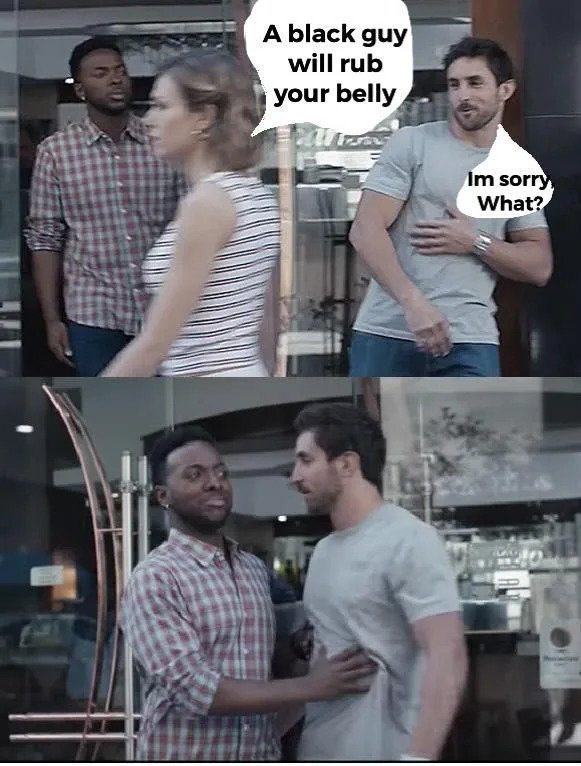
The image size is (581, 766). I want to click on register, so click(40, 629), click(44, 630).